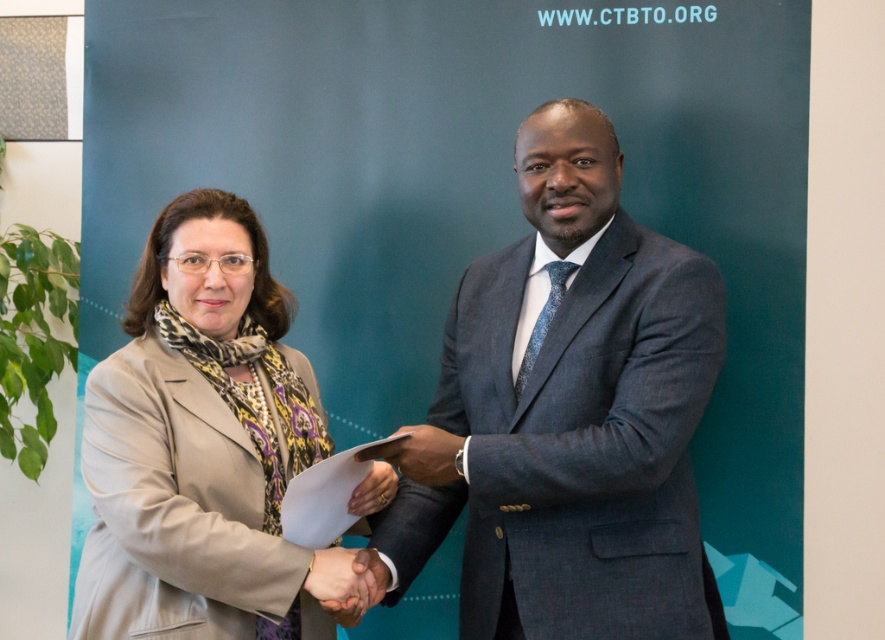
Question: Which object is positioned closest to the dark gray suit at center?

Choices:
 (A) matte black hand at center
 (B) matte black paper at center
 (C) beige fabric coat at left
 (D) smooth skin handshake at center

Answer: (B)

Question: Does dark gray suit at center have a lesser width compared to beige fabric coat at left?

Choices:
 (A) no
 (B) yes

Answer: (A)

Question: Does beige fabric coat at left come in front of matte black paper at center?

Choices:
 (A) yes
 (B) no

Answer: (A)

Question: Does matte black paper at center appear under matte black hand at center?

Choices:
 (A) yes
 (B) no

Answer: (B)

Question: Which of the following is the closest to the observer?

Choices:
 (A) (354, 621)
 (B) (599, 352)
 (C) (381, 468)
 (D) (267, 308)

Answer: (B)

Question: Which object appears farthest from the camera in this image?

Choices:
 (A) dark gray suit at center
 (B) matte black hand at center
 (C) beige fabric coat at left

Answer: (B)